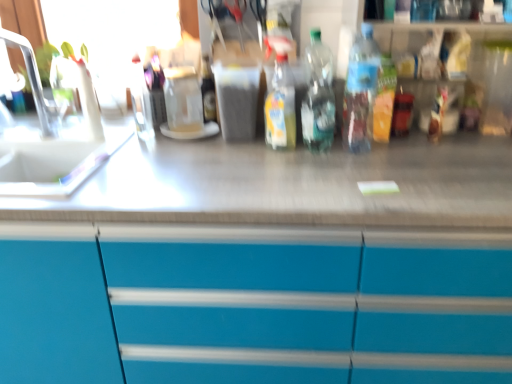
The width and height of the screenshot is (512, 384). Identify the location of vacant space in front of translucent plastic bottle at center, which is the 2th bottle from left to right. (282, 167).